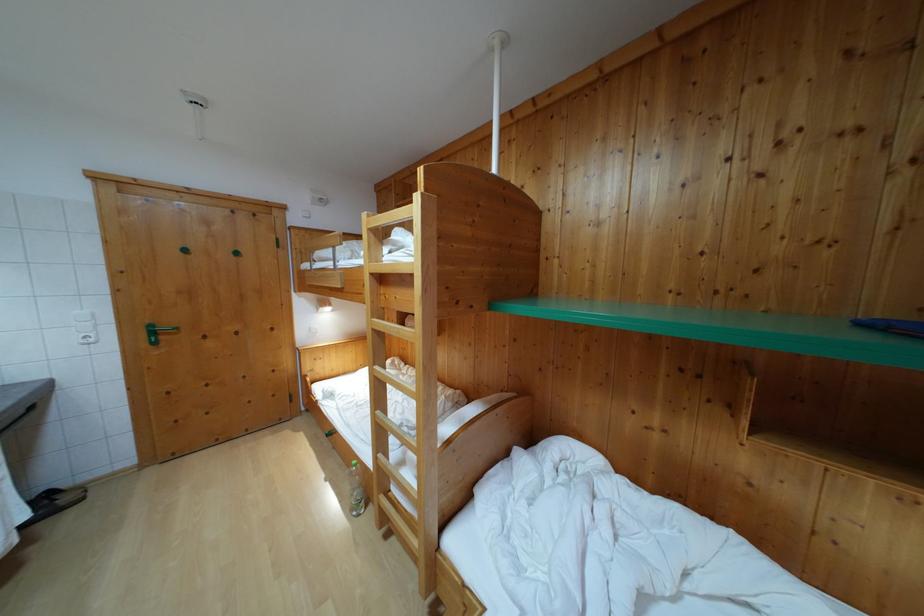
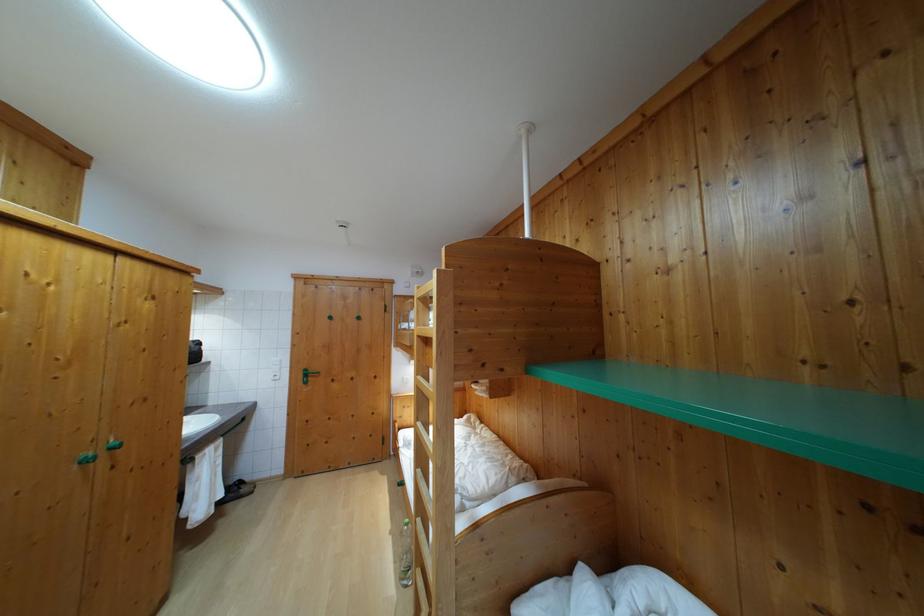
The point at [359,472] is marked in the first image. Where is the corresponding point in the second image?

(410, 532)